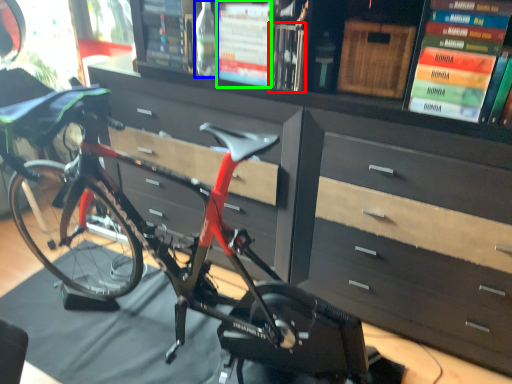
Question: Estimate the real-world distances between objects in this image. Which object is closer to book (highlighted by a red box), bottle (highlighted by a blue box) or book (highlighted by a green box)?

Choices:
 (A) bottle
 (B) book

Answer: (B)